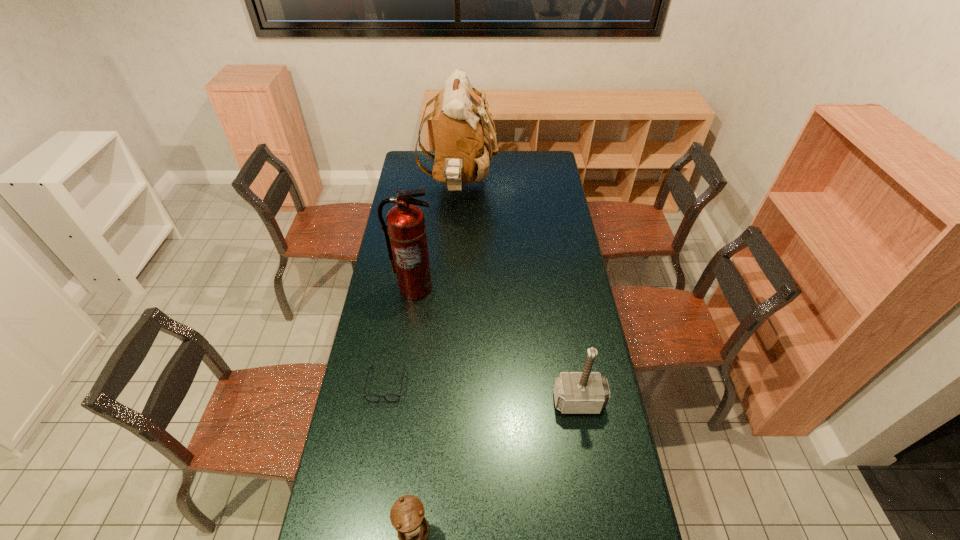
Locate an element on the screen. The image size is (960, 540). backpack that is positioned at the left edge is located at coordinates (461, 139).

You are a GUI agent. You are given a task and a screenshot of the screen. Output one action in this format:
    pyautogui.click(x=<x>, y=<y>)
    Task: Click on the fire extinguisher situated at the left edge
    The width and height of the screenshot is (960, 540).
    Given the screenshot: What is the action you would take?
    point(405,234)

You are a GUI agent. You are given a task and a screenshot of the screen. Output one action in this format:
    pyautogui.click(x=<x>, y=<y>)
    Task: Click on the spectacles at the left edge
    Image resolution: width=960 pixels, height=540 pixels.
    Given the screenshot: What is the action you would take?
    pyautogui.click(x=373, y=398)

Where is `object at the right edge`? object at the right edge is located at coordinates (586, 392).

The height and width of the screenshot is (540, 960). I want to click on object present at the far left corner, so click(461, 139).

Where is `vacant space at the far edge`? The width and height of the screenshot is (960, 540). vacant space at the far edge is located at coordinates point(528,166).

Where is `vacant area at the left edge of the desktop`? The width and height of the screenshot is (960, 540). vacant area at the left edge of the desktop is located at coordinates (421, 198).

Find the location of a particular element. This screenshot has width=960, height=540. free space at the right edge of the desktop is located at coordinates (554, 193).

Locate an element on the screen. Image resolution: width=960 pixels, height=540 pixels. vacant area at the far right corner is located at coordinates (538, 155).

You are a GUI agent. You are given a task and a screenshot of the screen. Output one action in this format:
    pyautogui.click(x=<x>, y=<y>)
    Task: Click on the blank region between the farthest object and the third shortest object
    
    Given the screenshot: What is the action you would take?
    pyautogui.click(x=518, y=293)